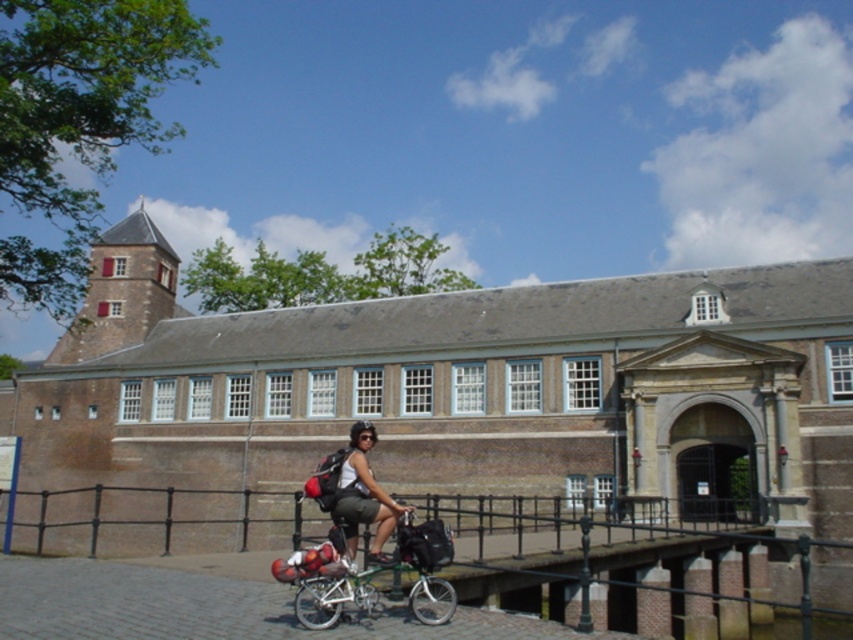
Is point (177, 522) positioned after point (337, 531)?

Yes, it is.

Measure the distance from black metal railing at center to green metallic bicycle at center.

black metal railing at center and green metallic bicycle at center are 9.66 meters apart.

Who is more distant from viewer, (111,504) or (340,600)?

The point (111,504) is more distant.

This screenshot has width=853, height=640. I want to click on black metal railing at center, so click(682, 580).

Between point (676, 564) and point (364, 496), which one is positioned behind?

Point (676, 564)

Who is taller, black metal railing at center or matte black backpack at center?

With more height is black metal railing at center.

Is point (662, 604) farther from camera compared to point (376, 490)?

Yes, it is behind point (376, 490).

Image resolution: width=853 pixels, height=640 pixels. Find the location of `black metal railing at center`. black metal railing at center is located at coordinates (682, 580).

Can you confirm if green metallic bicycle at center is shorter than matte black backpack at center?

Yes, green metallic bicycle at center is shorter than matte black backpack at center.

Which of these two, green metallic bicycle at center or matte black backpack at center, stands shorter?

green metallic bicycle at center

Describe the element at coordinates (426, 566) in the screenshot. I see `green metallic bicycle at center` at that location.

Where is `green metallic bicycle at center`? The height and width of the screenshot is (640, 853). green metallic bicycle at center is located at coordinates (426, 566).